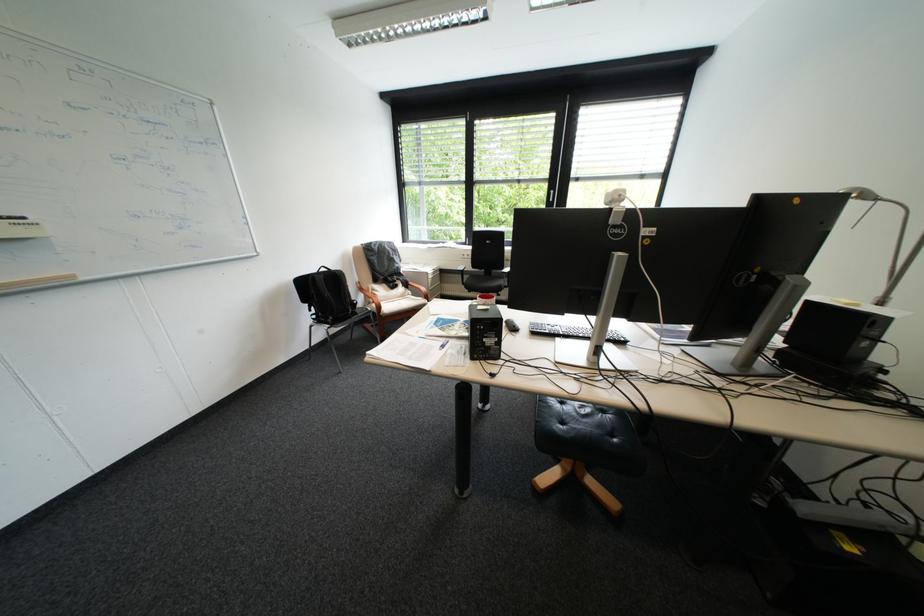
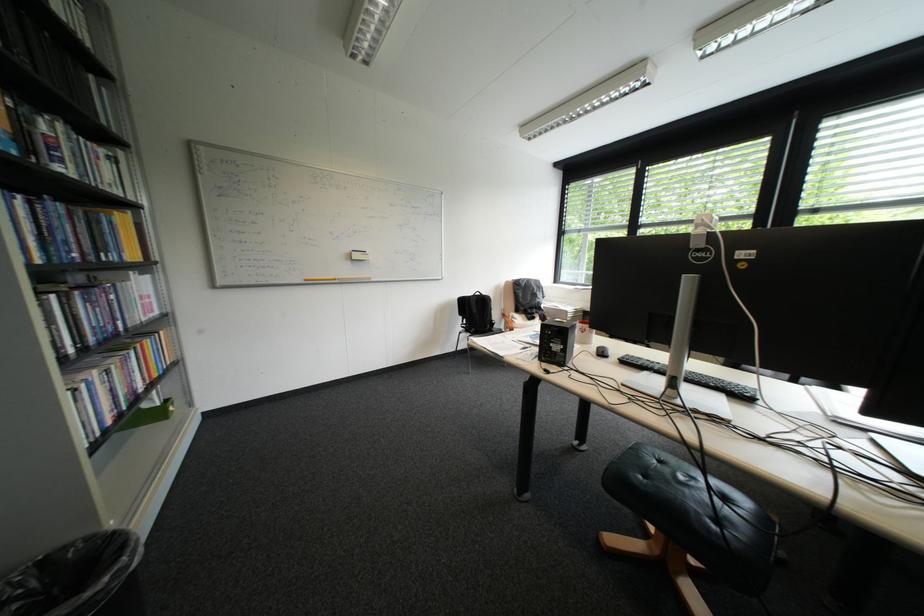
Question: The images are taken continuously from a first-person perspective. In which direction is your viewpoint rotating?

Choices:
 (A) Left
 (B) Right
 (C) Up
 (D) Down

Answer: (A)